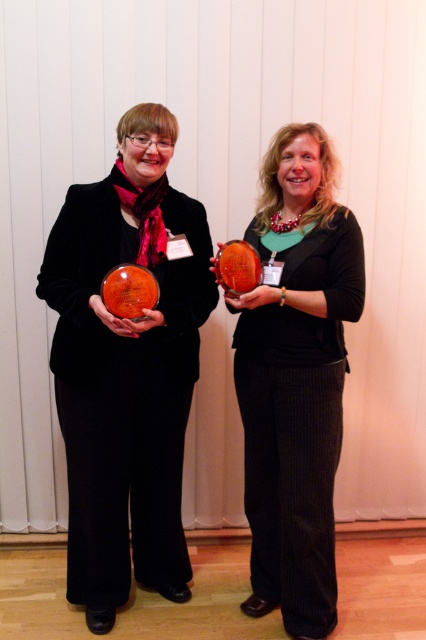
Question: Where is matte orange glass bowl at center located in relation to matte orange trophy at center in the image?

Choices:
 (A) above
 (B) below

Answer: (A)

Question: Which of the following is the closest to the observer?

Choices:
 (A) matte orange glass bowl at center
 (B) matte orange trophy at center

Answer: (A)

Question: Which object is closer to the camera taking this photo?

Choices:
 (A) matte orange trophy at center
 (B) matte orange glass bowl at center

Answer: (B)

Question: Considering the relative positions of matte orange glass bowl at center and matte orange trophy at center in the image provided, where is matte orange glass bowl at center located with respect to matte orange trophy at center?

Choices:
 (A) above
 (B) below

Answer: (A)

Question: In this image, where is matte orange glass bowl at center located relative to matte orange trophy at center?

Choices:
 (A) right
 (B) left

Answer: (B)